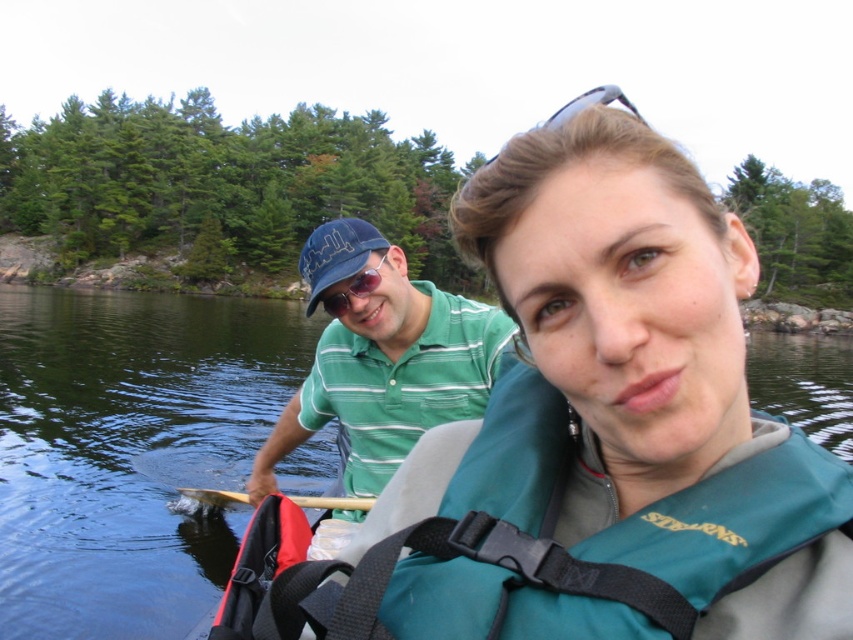
Question: Does teal life vest at center have a larger size compared to brown wood paddle at lower center?

Choices:
 (A) no
 (B) yes

Answer: (B)

Question: Does teal life vest at center appear on the left side of sunglasses at upper center?

Choices:
 (A) no
 (B) yes

Answer: (B)

Question: Which point is farther to the camera?

Choices:
 (A) (613, 541)
 (B) (618, 88)
 (C) (357, 502)

Answer: (C)

Question: Estimate the real-world distances between objects in this image. Which object is farther from the brown wood paddle at lower center?

Choices:
 (A) green water at center
 (B) teal life vest at center

Answer: (A)

Question: Observing the image, what is the correct spatial positioning of teal life vest at center in reference to green striped polo shirt at center?

Choices:
 (A) right
 (B) left

Answer: (A)

Question: Which point is farther from the camera taking this photo?

Choices:
 (A) (219, 506)
 (B) (190, 621)

Answer: (A)